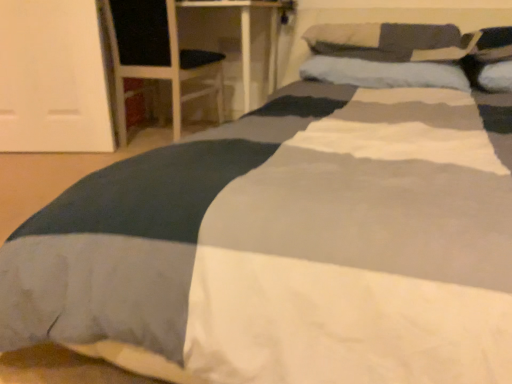
Question: Would you consider black fabric armchair at left to be distant from soft gray pillow at upper right, which appears as the first pillow when viewed from the top?

Choices:
 (A) yes
 (B) no

Answer: (B)

Question: From a real-world perspective, is black fabric armchair at left on top of soft gray pillow at upper right, acting as the second pillow starting from the bottom?

Choices:
 (A) yes
 (B) no

Answer: (B)

Question: Is soft gray pillow at upper right, acting as the second pillow starting from the bottom, surrounded by black fabric armchair at left?

Choices:
 (A) yes
 (B) no

Answer: (B)

Question: Is black fabric armchair at left bigger than soft gray pillow at upper right, acting as the second pillow starting from the bottom?

Choices:
 (A) no
 (B) yes

Answer: (B)

Question: Can you confirm if black fabric armchair at left is thinner than soft gray pillow at upper right, acting as the second pillow starting from the bottom?

Choices:
 (A) no
 (B) yes

Answer: (A)

Question: From the image's perspective, is black fabric armchair at left above or below soft gray pillow at upper right, which appears as the first pillow when viewed from the top?

Choices:
 (A) below
 (B) above

Answer: (B)

Question: Is black fabric armchair at left wider or thinner than soft gray pillow at upper right, acting as the second pillow starting from the bottom?

Choices:
 (A) thin
 (B) wide

Answer: (B)

Question: Considering the relative positions of black fabric armchair at left and soft gray pillow at upper right, which appears as the first pillow when viewed from the top, in the image provided, is black fabric armchair at left to the left or to the right of soft gray pillow at upper right, which appears as the first pillow when viewed from the top,?

Choices:
 (A) left
 (B) right

Answer: (A)

Question: Based on their sizes in the image, would you say black fabric armchair at left is bigger or smaller than soft gray pillow at upper right, acting as the second pillow starting from the bottom?

Choices:
 (A) big
 (B) small

Answer: (A)

Question: From the image's perspective, is soft gray pillow at upper right, acting as the second pillow starting from the bottom, located above or below soft blue pillow at center, which is the first pillow from bottom to top?

Choices:
 (A) above
 (B) below

Answer: (A)

Question: Is soft gray pillow at upper right, which appears as the first pillow when viewed from the top, situated inside soft blue pillow at center, which is the first pillow from bottom to top, or outside?

Choices:
 (A) inside
 (B) outside

Answer: (B)

Question: Considering the positions of soft gray pillow at upper right, which appears as the first pillow when viewed from the top, and soft blue pillow at center, which is counted as the second pillow, starting from the top, in the image, is soft gray pillow at upper right, which appears as the first pillow when viewed from the top, taller or shorter than soft blue pillow at center, which is counted as the second pillow, starting from the top,?

Choices:
 (A) tall
 (B) short

Answer: (A)

Question: Considering the positions of soft gray pillow at upper right, which appears as the first pillow when viewed from the top, and soft blue pillow at center, which is counted as the second pillow, starting from the top, in the image, is soft gray pillow at upper right, which appears as the first pillow when viewed from the top, bigger or smaller than soft blue pillow at center, which is counted as the second pillow, starting from the top,?

Choices:
 (A) small
 (B) big

Answer: (B)

Question: Is point (385, 24) closer or farther from the camera than point (162, 44)?

Choices:
 (A) closer
 (B) farther

Answer: (A)

Question: Looking at the image, does soft gray pillow at upper right, which appears as the first pillow when viewed from the top, seem bigger or smaller compared to black fabric armchair at left?

Choices:
 (A) big
 (B) small

Answer: (B)